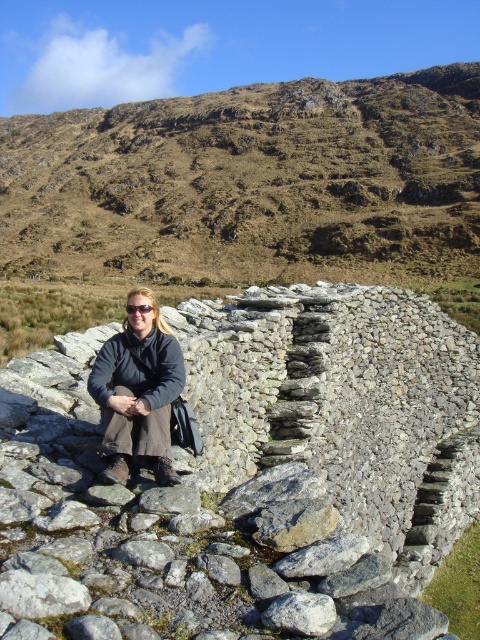
Question: Does brown grassy hillside at upper center come in front of matte black coat at center?

Choices:
 (A) no
 (B) yes

Answer: (A)

Question: Which is farther from the brown grassy hillside at upper center?

Choices:
 (A) matte black coat at center
 (B) gray rough stone wall at center

Answer: (A)

Question: Among these objects, which one is nearest to the camera?

Choices:
 (A) brown grassy hillside at upper center
 (B) matte black coat at center

Answer: (B)

Question: Can you confirm if brown grassy hillside at upper center is smaller than matte black coat at center?

Choices:
 (A) no
 (B) yes

Answer: (A)

Question: Estimate the real-world distances between objects in this image. Which object is closer to the brown grassy hillside at upper center?

Choices:
 (A) matte black coat at center
 (B) gray rough stone wall at center

Answer: (B)

Question: From the image, what is the correct spatial relationship of brown grassy hillside at upper center in relation to matte black coat at center?

Choices:
 (A) below
 (B) above

Answer: (B)